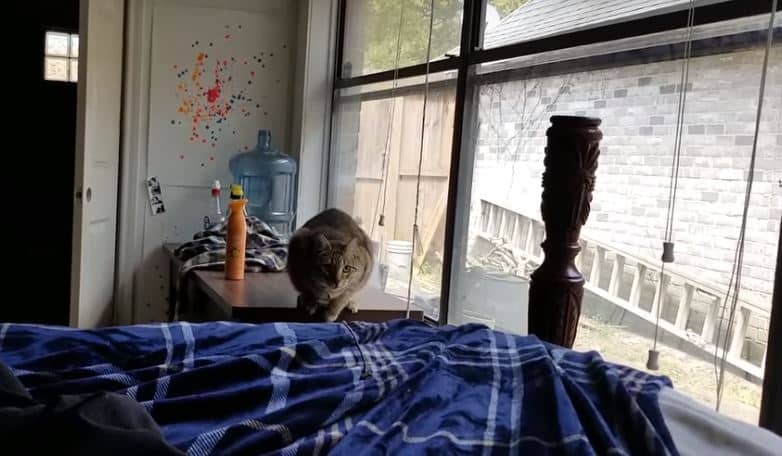
Find the location of `water jug`. water jug is located at coordinates (264, 172).